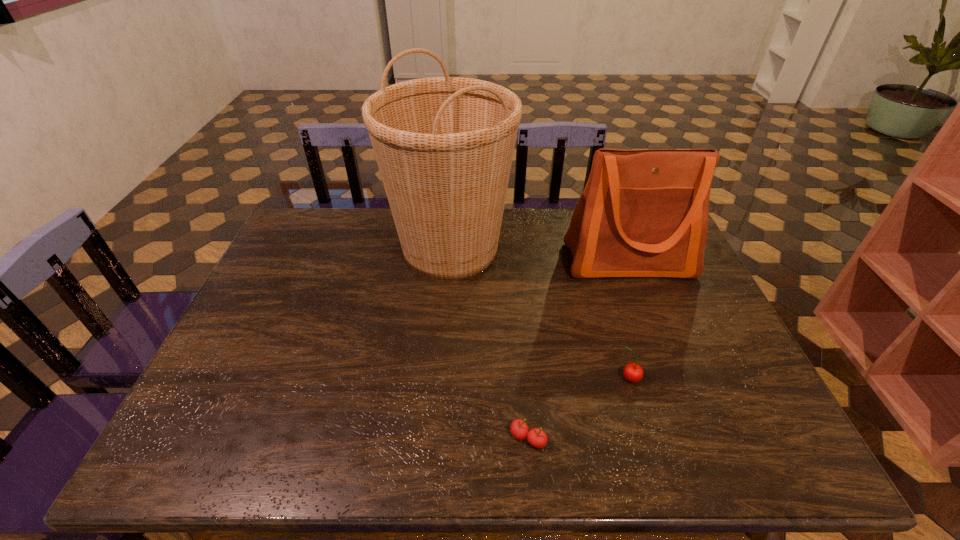
Where is `basket that is at the far edge`? basket that is at the far edge is located at coordinates (444, 146).

This screenshot has height=540, width=960. What are the coordinates of `shopping bag that is at the far edge` in the screenshot? It's located at (643, 213).

I want to click on object situated at the near edge, so click(x=536, y=437).

Locate an element on the screen. The image size is (960, 540). object at the right edge is located at coordinates pyautogui.click(x=643, y=213).

Locate an element on the screen. object located in the far right corner section of the desktop is located at coordinates (643, 213).

In the image, there is a desktop. Where is `vacant area at the far edge`? vacant area at the far edge is located at coordinates (348, 213).

In the image, there is a desktop. At what (x,y) coordinates should I click in order to perform the action: click on vacant space at the near edge. Please return your answer as a coordinate pair (x, y). Image resolution: width=960 pixels, height=540 pixels. Looking at the image, I should click on (665, 436).

Where is `vacant region at the left edge of the desktop`? vacant region at the left edge of the desktop is located at coordinates (280, 272).

The width and height of the screenshot is (960, 540). Find the location of `vacant space at the right edge of the desktop`. vacant space at the right edge of the desktop is located at coordinates (703, 341).

In the image, there is a desktop. Identify the location of vacant space at the far left corner. (313, 209).